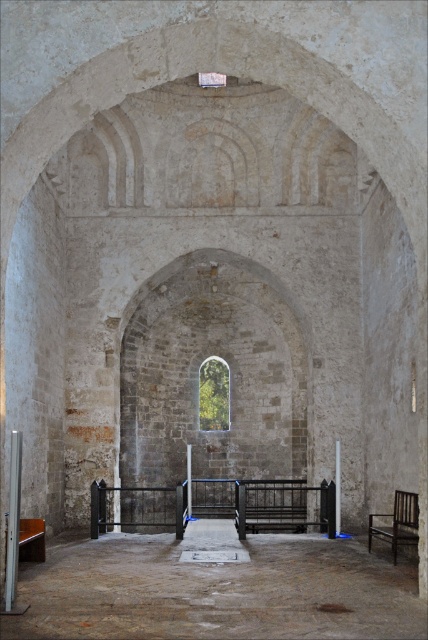
Question: Which point is farther to the camera?

Choices:
 (A) brown stone floor at center
 (B) smooth gray pillar at left
 (C) wooden bench at lower left

Answer: (C)

Question: From the image, what is the correct spatial relationship of dark brown wooden chair at right in relation to wooden bench at lower left?

Choices:
 (A) left
 (B) right

Answer: (B)

Question: Is brown stone floor at center wider than smooth gray pillar at left?

Choices:
 (A) no
 (B) yes

Answer: (B)

Question: In this image, where is smooth gray pillar at left located relative to smooth stone pillar at center?

Choices:
 (A) above
 (B) below

Answer: (A)

Question: Which of the following is the closest to the observer?

Choices:
 (A) (41, 550)
 (B) (383, 515)
 (C) (202, 605)
 (D) (339, 477)

Answer: (C)

Question: Which object is closer to the camera taking this photo?

Choices:
 (A) smooth stone pillar at center
 (B) dark brown wooden chair at right
 (C) brown stone floor at center
 (D) smooth gray pillar at left

Answer: (C)